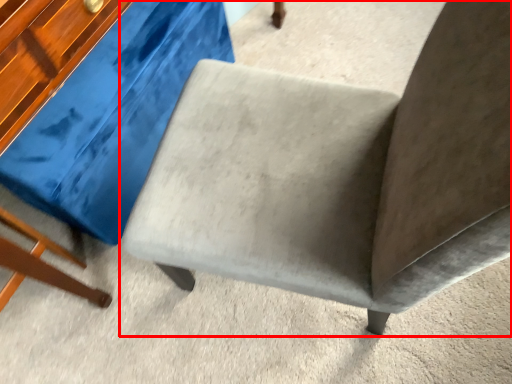
Question: From the image, what is the correct spatial relationship of chair (annotated by the red box) in relation to swivel chair?

Choices:
 (A) left
 (B) right

Answer: (B)